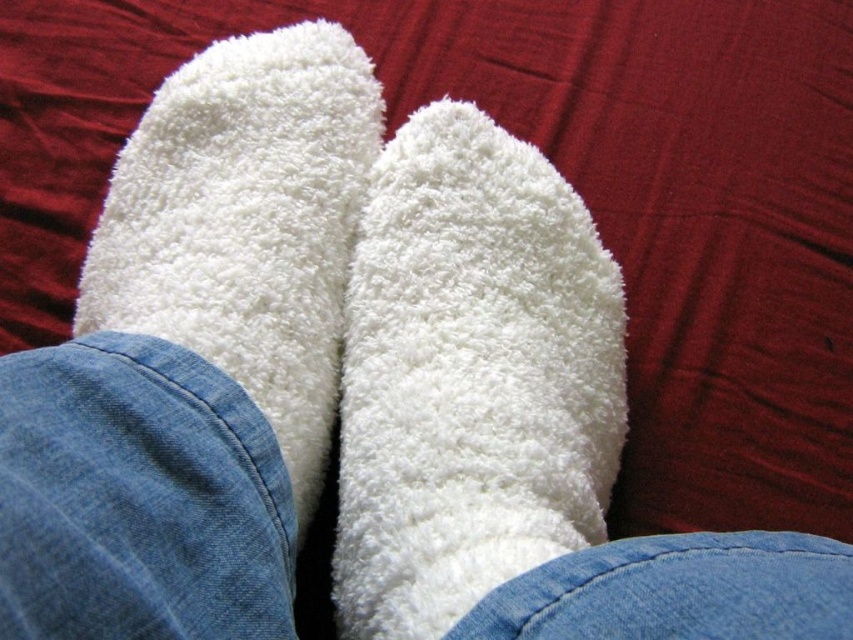
You are trying to match a pair of socks for a gift. You have a white fluffy sock at center and a white fluffy socks at center in front of you. Which one is shorter?

The white fluffy sock at center is shorter than the white fluffy socks at center.

You are a tailor trying to match a pair of white fluffy socks. You have two options in front of you, the white fluffy sock at center and the white fluffy socks at center. Which one is wider?

The white fluffy socks at center are wider than the white fluffy sock at center.

You are trying to place a sticker exactly at the center of the image. The white fluffy sock at center is located at coordinates 0.591, 0.552. Is the sticker placed correctly?

The sticker should be placed at the exact center of the image, which is typically at coordinates (426, 320). The white fluffy sock at center is located at (469, 378), which is slightly to the right and below the true center. Therefore, the sticker is not placed correctly.